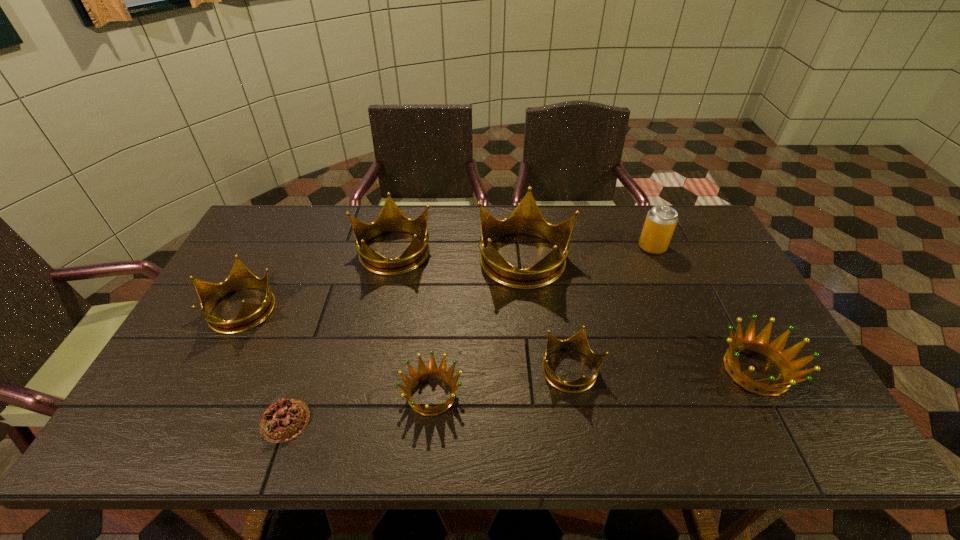
Locate an element on the screen. Image resolution: width=960 pixels, height=540 pixels. object that stands as the fourth closest to the third biggest gold crown is located at coordinates [526, 219].

Where is `crown that is the closest to the leftmost object`? The image size is (960, 540). crown that is the closest to the leftmost object is located at coordinates (391, 219).

Identify the location of crown that stands as the closest to the tallest crown. click(x=391, y=219).

Identify which gold crown is the third closest to the pop (soda). Please provide its 2D coordinates. Your answer should be formatted as a tuple, i.e. [(x, y)], where the tuple contains the x and y coordinates of a point satisfying the conditions above.

[(391, 219)]

Where is `gold crown that is the closest to the nearest gold crown`? This screenshot has height=540, width=960. gold crown that is the closest to the nearest gold crown is located at coordinates (526, 219).